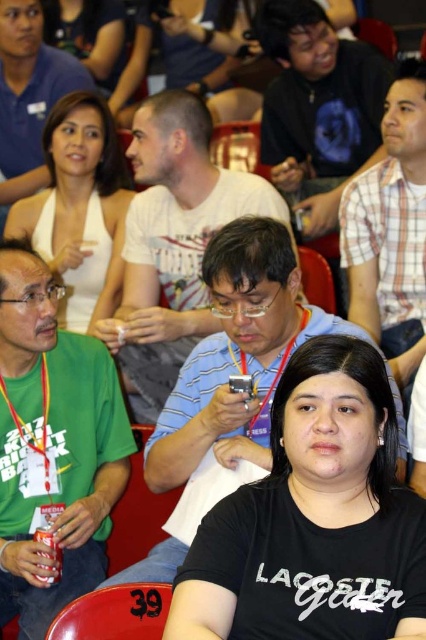
Is dark blue t-shirt at center taller than matte white shirt at upper left?

Yes.

Can you confirm if dark blue t-shirt at center is wider than matte white shirt at upper left?

Correct, the width of dark blue t-shirt at center exceeds that of matte white shirt at upper left.

Where is `dark blue t-shirt at center`? dark blue t-shirt at center is located at coordinates (317, 108).

Which of these two, green matte shirt at center or white matte halter top at upper left, stands shorter?

white matte halter top at upper left is shorter.

Can you confirm if green matte shirt at center is wider than white matte halter top at upper left?

No.

Find the location of a particular element. This screenshot has width=426, height=640. green matte shirt at center is located at coordinates (52, 445).

This screenshot has width=426, height=640. What are the coordinates of `green matte shirt at center` in the screenshot? It's located at (52, 445).

From the picture: Between matte white shirt at upper left and matte silver can at lower left, which one is positioned higher?

Positioned higher is matte white shirt at upper left.

What do you see at coordinates (28, 97) in the screenshot?
I see `matte white shirt at upper left` at bounding box center [28, 97].

Is point (19, 128) positioned after point (40, 576)?

Yes, it is.

This screenshot has width=426, height=640. I want to click on matte white shirt at upper left, so click(28, 97).